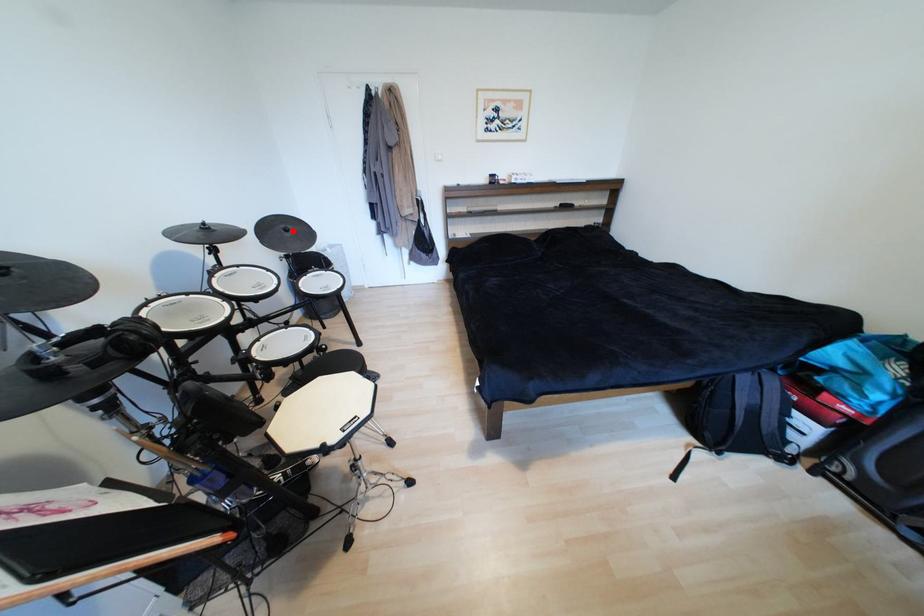
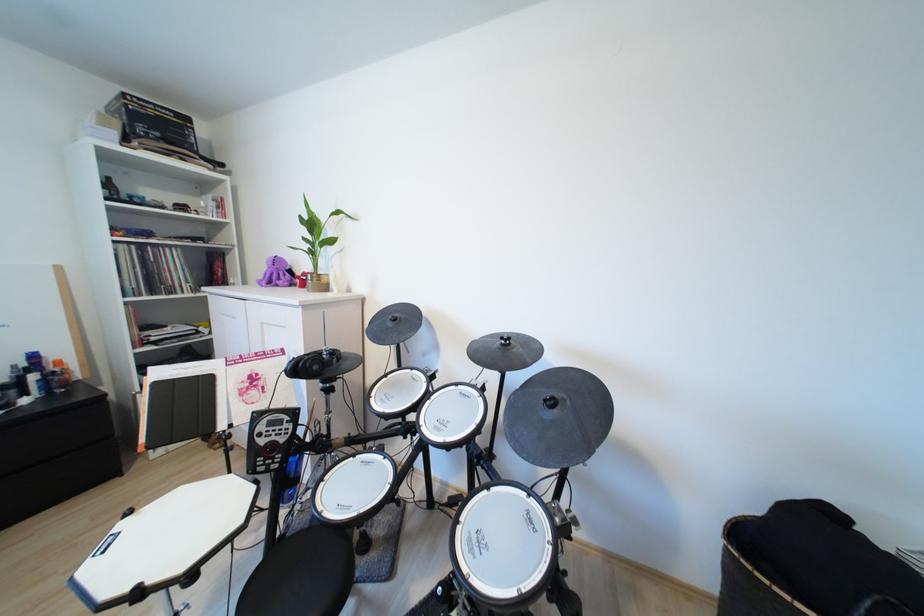
Question: I am providing you with two images of the same scene from different viewpoints. A red point is shown in image1. For the corresponding object point in image2, is it positioned nearer or farther from the camera?

Choices:
 (A) Nearer
 (B) Farther

Answer: (B)